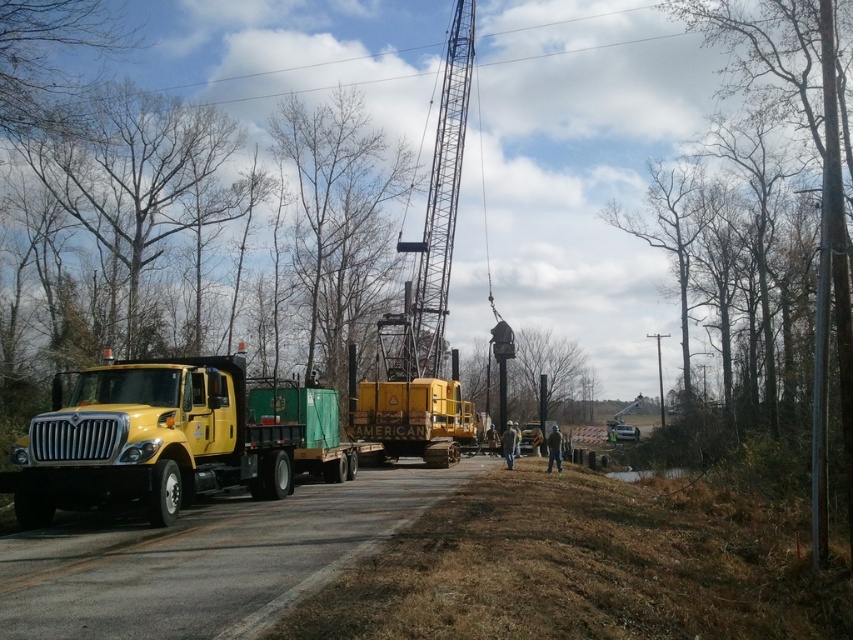
You are a traffic officer observing the construction scene. You need to direct a delivery van to pass through the area. The van requires a clear path between the yellow matte truck at left and the metallic gray crane at upper center. Is there enough space for the van to pass through?

The yellow matte truck at left is positioned to the left of the metallic gray crane at upper center, so there is space between them for the van to pass through.

You are a delivery driver who needs to park your truck at the construction site. The site manager tells you to park your truck so that the point at coordinates (172,438) is visible from the main office window. Based on the image, where should you position your truck relative to the yellow matte truck at left?

The point at coordinates (172,438) is located on the yellow matte truck at left. To ensure this point remains visible from the main office window, you should position your truck in a way that does not block the view of the yellow matte truck at left, possibly parking it behind or to the side without obstructing that specific area.

You are a traffic officer assessing the road conditions. The road has a width of 12 feet. You need to determine if the yellow matte truck at left and the metallic gray crane at upper center can be positioned side by side on the road without exceeding the road width. Can they?

The yellow matte truck at left has a larger width than the metallic gray crane at upper center. Since the road is only 12 feet wide, and the truck alone is wider than the crane, positioning them side by side would likely exceed the road width. Therefore, they cannot be placed side by side without exceeding the road width.